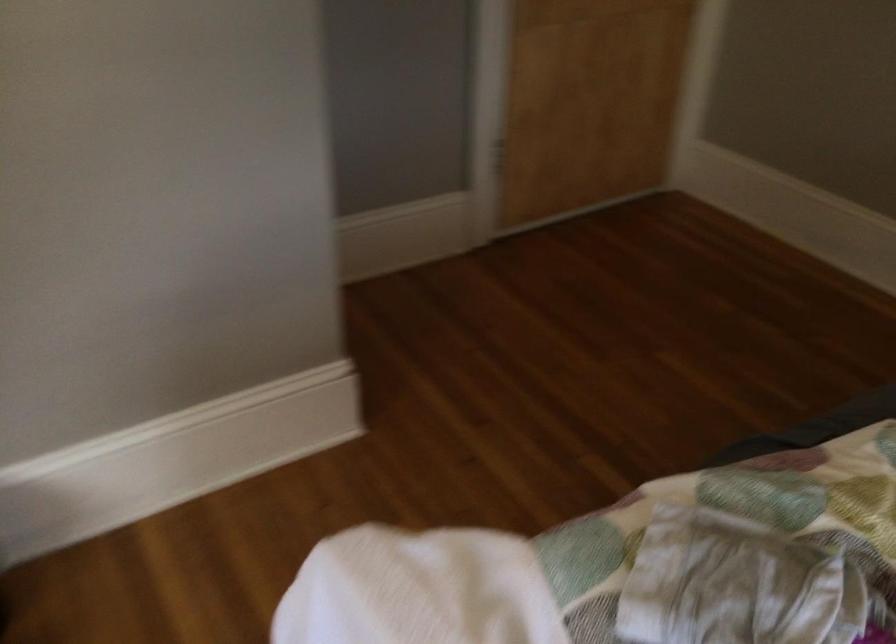
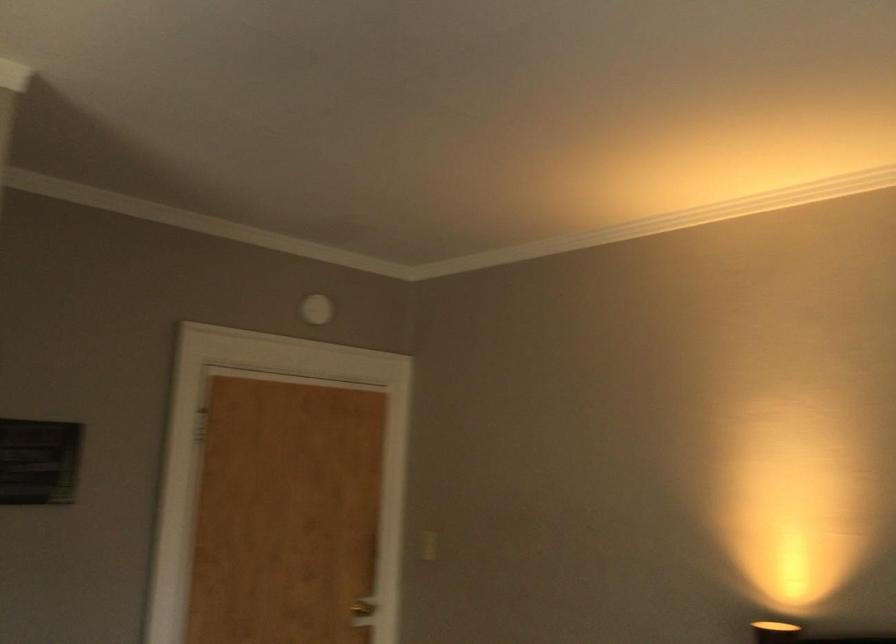
Question: The first image is from the beginning of the video and the second image is from the end. How did the camera likely rotate when shooting the video?

Choices:
 (A) Left
 (B) Right
 (C) Up
 (D) Down

Answer: (C)